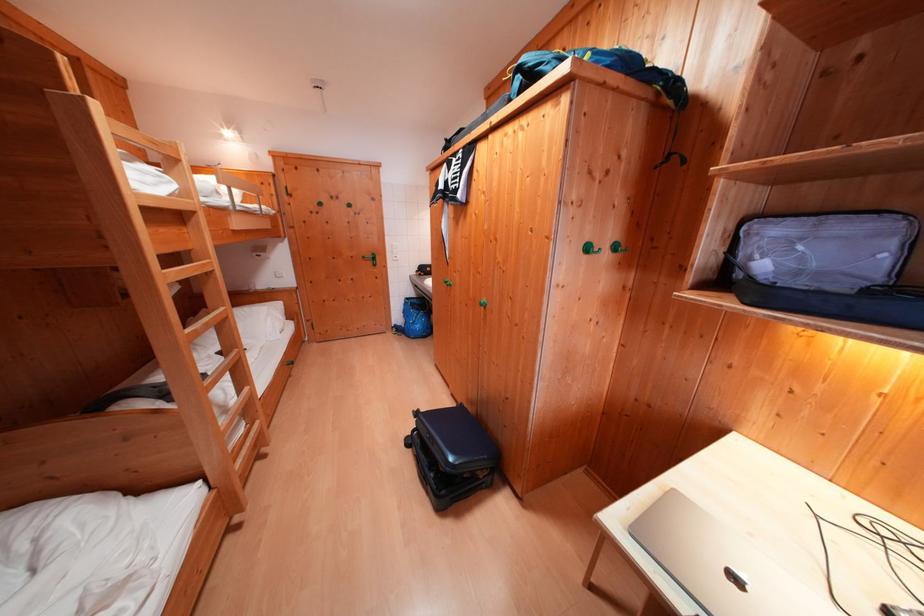
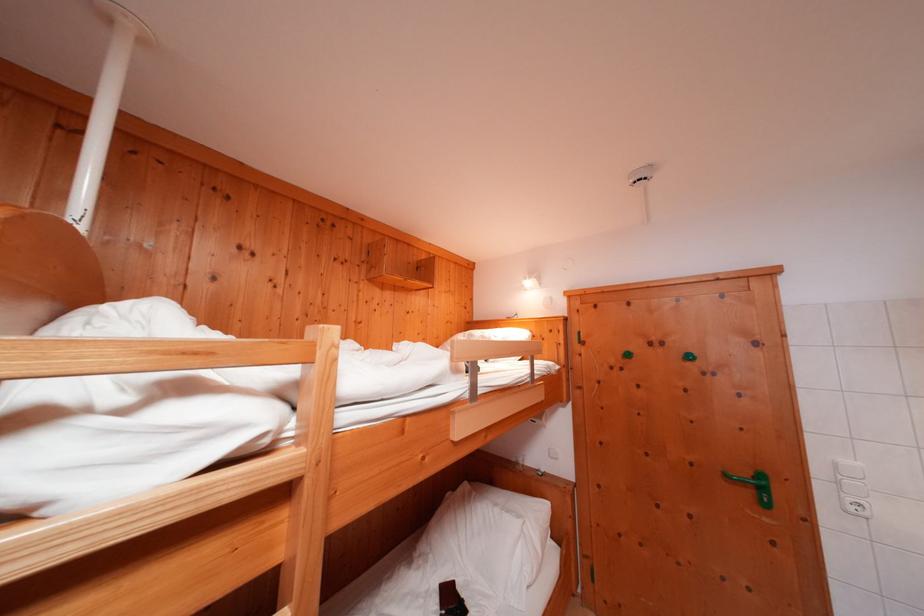
In the second image, find the point that corresponds to pixel 382 262 in the first image.

(771, 493)